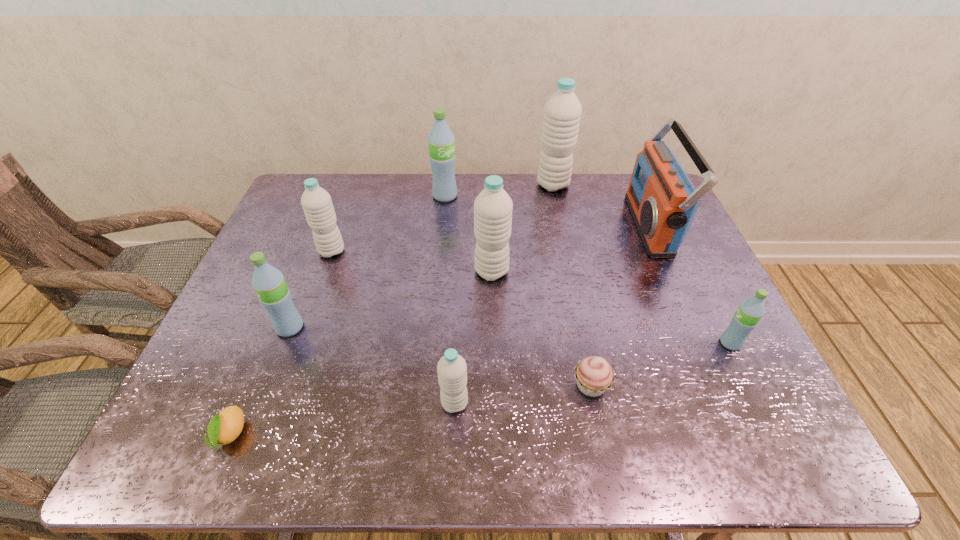
This screenshot has width=960, height=540. I want to click on free space between the farthest green water bottle and the nearest white water bottle, so click(x=450, y=300).

Locate an element on the screen. vacant area that lies between the radio receiver and the biggest white water bottle is located at coordinates (602, 205).

The image size is (960, 540). What are the coordinates of `free space between the biggest green water bottle and the nearest white water bottle` in the screenshot? It's located at (450, 300).

This screenshot has width=960, height=540. I want to click on free space between the ninth tallest object and the biggest green water bottle, so click(518, 291).

Identify the location of unoccupied position between the farthest green water bottle and the third water bottle from right to left. (468, 234).

I want to click on vacant area that lies between the shortest object and the smallest green water bottle, so click(x=480, y=389).

Locate an element on the screen. The height and width of the screenshot is (540, 960). free space between the second green water bottle from left to right and the fifth water bottle from left to right is located at coordinates (468, 234).

Identify the location of free area in between the leftmost green water bottle and the third white water bottle from right to left. The image size is (960, 540). (372, 365).

Locate an element on the screen. This screenshot has height=540, width=960. free spot between the farthest white water bottle and the cupcake is located at coordinates (572, 286).

Locate an element on the screen. This screenshot has height=540, width=960. object that is the seventh closest one to the sixth object from left to right is located at coordinates (274, 294).